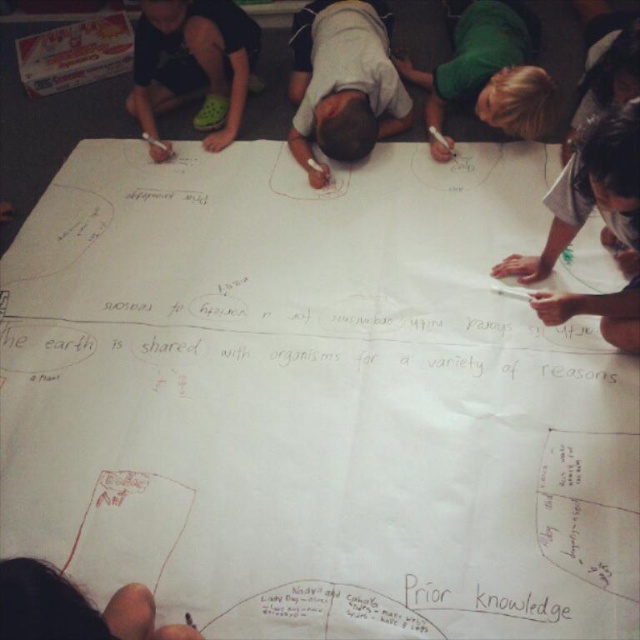
Looking at the scene where children are collaborating around a large paper, can you tell me which child is positioned to the left between the white matte shirt at center and the green matte shirt at upper right?

The white matte shirt at center is positioned to the left of the green matte shirt at upper right.

You are a teacher observing the children working on the paper. You need to identify which child is closer to the top of the paper. Which child is positioned higher on the paper between the matte black shirt at upper left and the green matte shirt at upper right?

The matte black shirt at upper left is positioned higher on the paper than the green matte shirt at upper right because it is located at the upper left section, which is closer to the top edge of the paper compared to the upper right section.

Consider the image. You are a teacher observing a group of students working on a collaborative project. You notice two students wearing a white matte shirt at center and a matte black shirt at upper left. Which student is closer to the shared workspace in the center of the image?

The white matte shirt at center is closer to the shared workspace in the center of the image because it is positioned at the center, while the matte black shirt at upper left is located further away at the upper left corner.